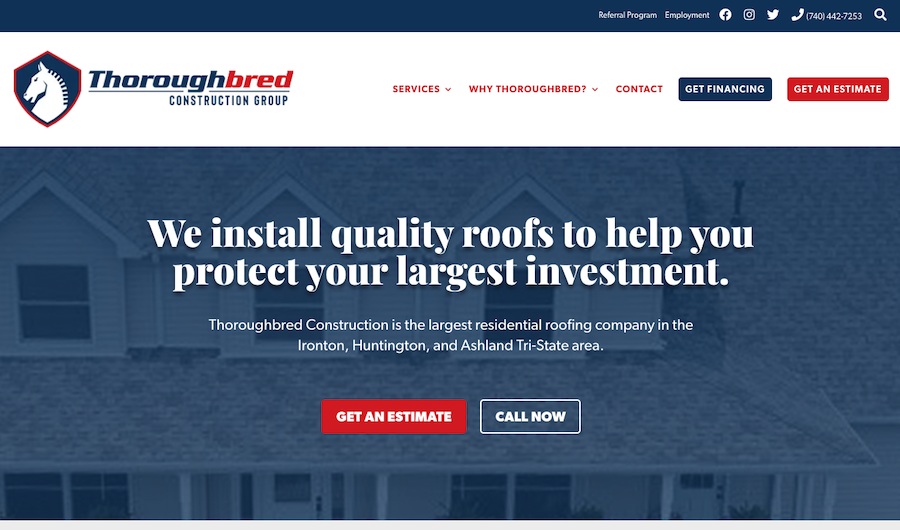
The height and width of the screenshot is (530, 900). What are the coordinates of `window` in the screenshot? It's located at (63, 321).